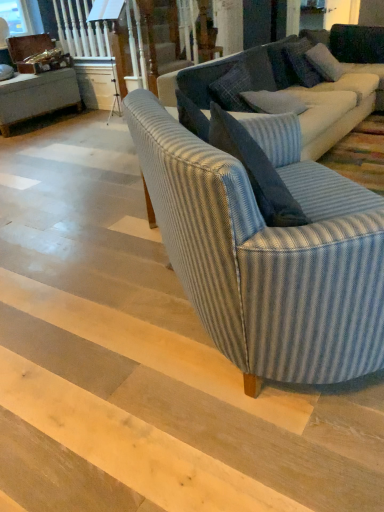
Identify the location of vacant position to the left of blue striped fabric couch at center, which is the 2th studio couch in back-to-front order. (78, 329).